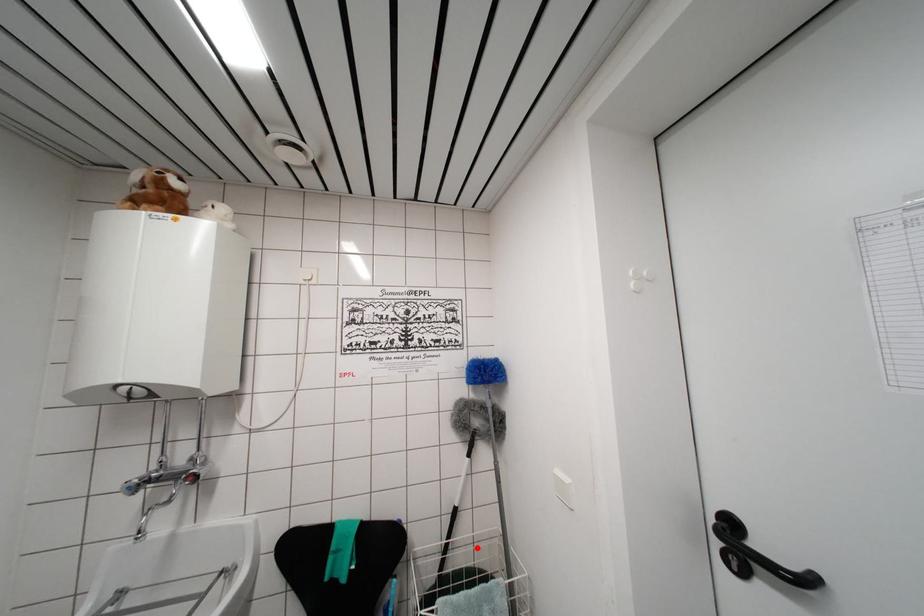
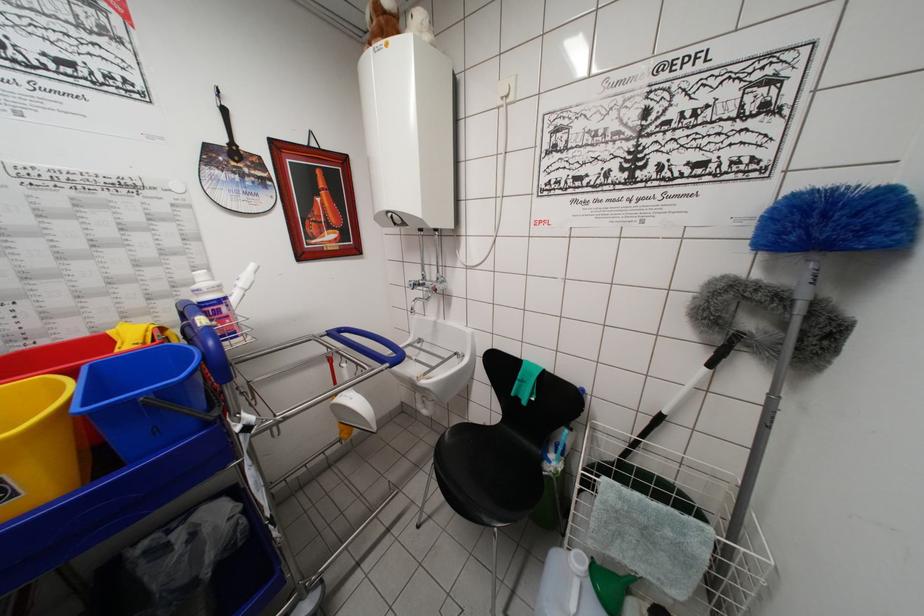
Question: I am providing you with two images of the same scene from different viewpoints. Image1 has a red point marked. In image2, the corresponding 3D location appears at what relative position? Reply with the corresponding letter.

Choices:
 (A) Closer
 (B) Farther

Answer: (A)